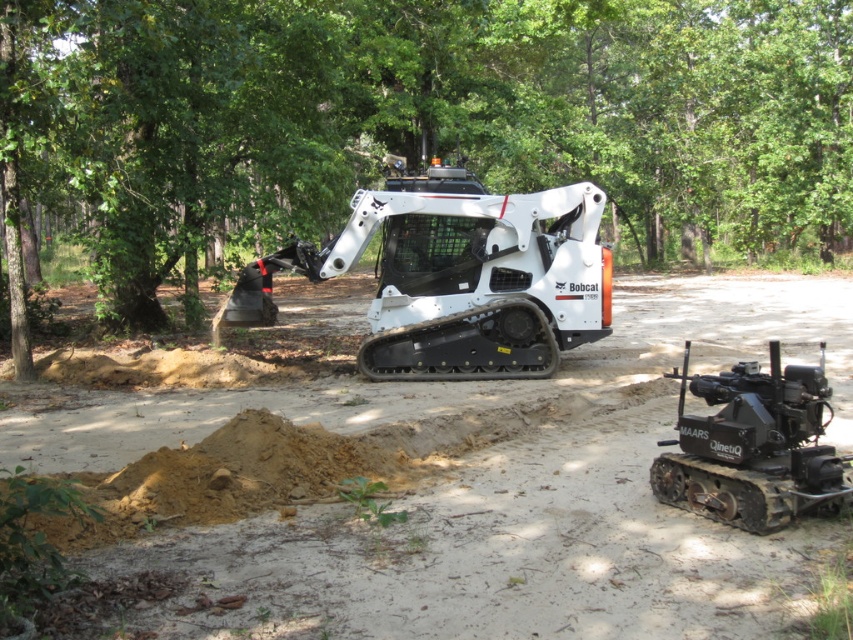
Question: Does green leafy tree at upper center appear on the left side of black rubber tracked vehicle at lower right?

Choices:
 (A) yes
 (B) no

Answer: (A)

Question: Which point appears closest to the camera in this image?

Choices:
 (A) (146, 234)
 (B) (730, 467)

Answer: (B)

Question: Does brown sandy soil at center have a lesser width compared to black rubber tracked vehicle at lower right?

Choices:
 (A) no
 (B) yes

Answer: (A)

Question: Can you confirm if brown sandy soil at center is thinner than white matte bobcat at center?

Choices:
 (A) no
 (B) yes

Answer: (A)

Question: Among these points, which one is nearest to the camera?

Choices:
 (A) (305, 577)
 (B) (753, 372)
 (C) (419, 298)

Answer: (A)

Question: Among these points, which one is nearest to the camera?

Choices:
 (A) (387, 122)
 (B) (790, 400)
 (C) (550, 209)

Answer: (B)